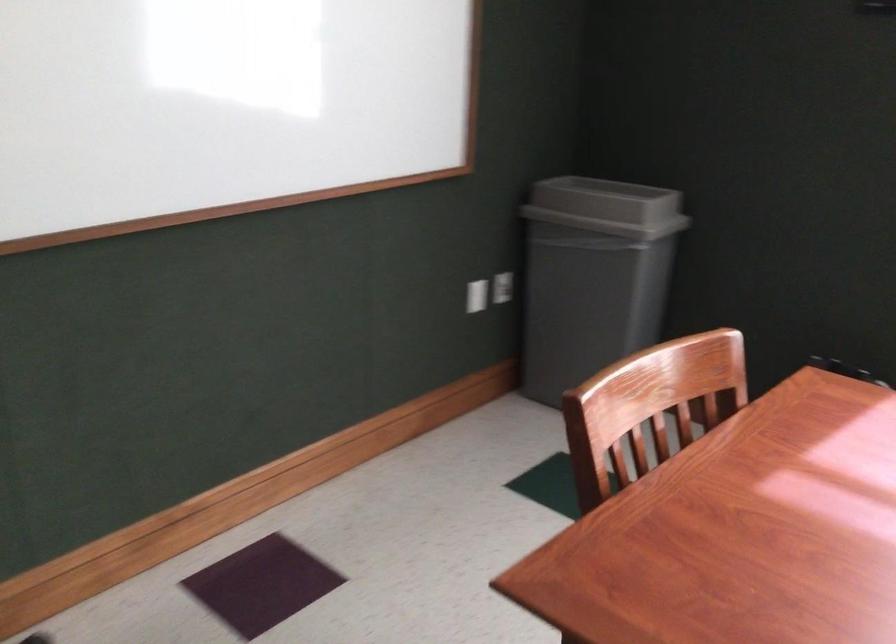
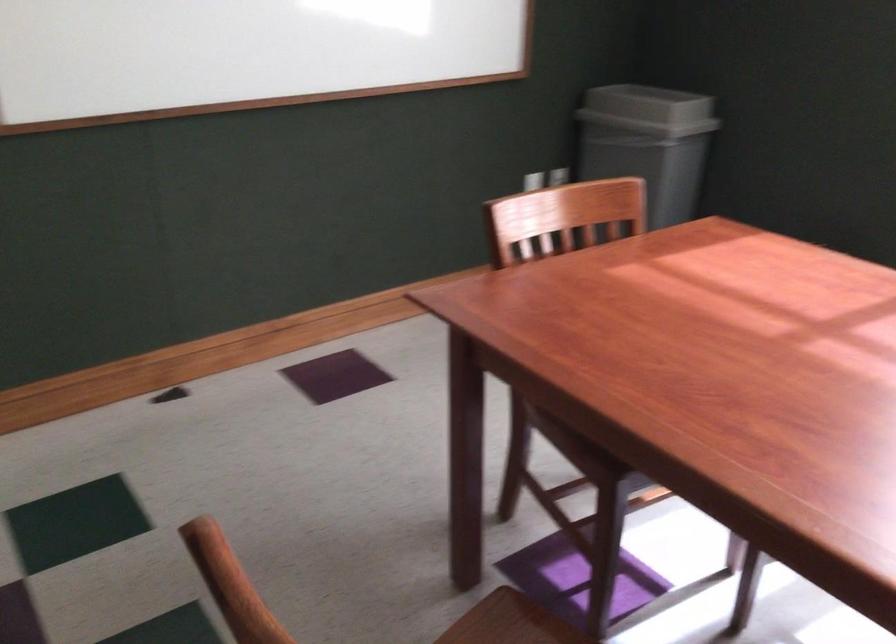
The point at (616, 210) is marked in the first image. Where is the corresponding point in the second image?

(648, 109)